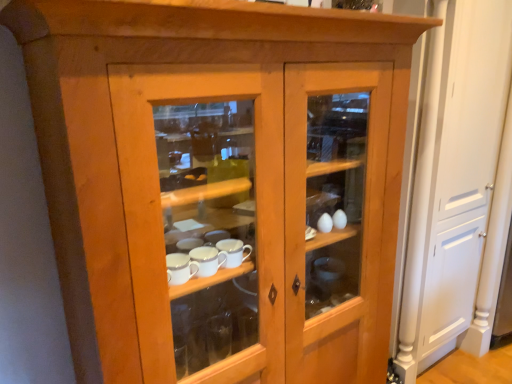
At what (x,y) coordinates should I click in order to perform the action: click on white glossy screen door at right. Please return your answer as a coordinate pair (x, y). The image size is (512, 384). Looking at the image, I should click on (459, 186).

This screenshot has width=512, height=384. What do you see at coordinates (459, 186) in the screenshot?
I see `white glossy screen door at right` at bounding box center [459, 186].

Find the location of a particular element. white glossy screen door at right is located at coordinates (459, 186).